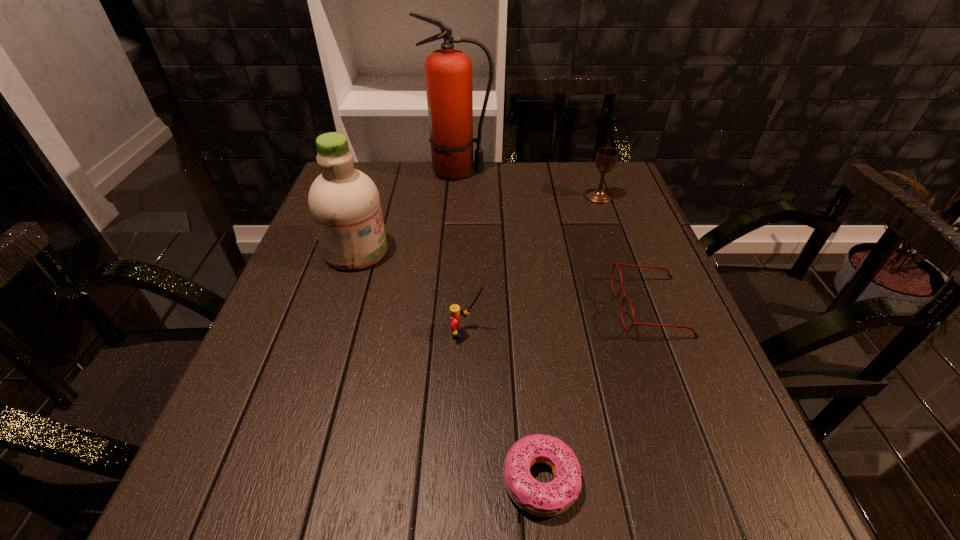
Locate an element on the screen. Image resolution: width=960 pixels, height=540 pixels. free region located on the nozzle of the tallest object is located at coordinates (607, 172).

Locate an element on the screen. Image resolution: width=960 pixels, height=540 pixels. free location located on the front label of the second tallest object is located at coordinates (473, 251).

Locate an element on the screen. This screenshot has height=540, width=960. vacant space located on the front of the chalice is located at coordinates (616, 247).

Locate an element on the screen. This screenshot has height=540, width=960. blank space located 0.170m on the front-facing side of the Lego is located at coordinates point(571,333).

At what (x,y) coordinates should I click in order to perform the action: click on vacant space located 0.330m on the face of the spectacles. Please return your answer as a coordinate pair (x, y). Image resolution: width=960 pixels, height=540 pixels. Looking at the image, I should click on (455, 307).

Image resolution: width=960 pixels, height=540 pixels. Identify the location of blank space located on the face of the spectacles. (543, 307).

What are the coordinates of `blank space located 0.250m on the face of the spectacles` in the screenshot? It's located at (494, 307).

Identify the location of vacant space located 0.260m on the back of the shortest object. [524, 319].

You are a GUI agent. You are given a task and a screenshot of the screen. Output one action in this format:
    pyautogui.click(x=<x>, y=<y>)
    Task: Click on the fire extinguisher situated at the far edge
    
    Given the screenshot: What is the action you would take?
    pyautogui.click(x=448, y=72)

At what (x,y) coordinates should I click in order to perform the action: click on chalice located in the far edge section of the desktop. Please return your answer as a coordinate pair (x, y). Looking at the image, I should click on (606, 158).